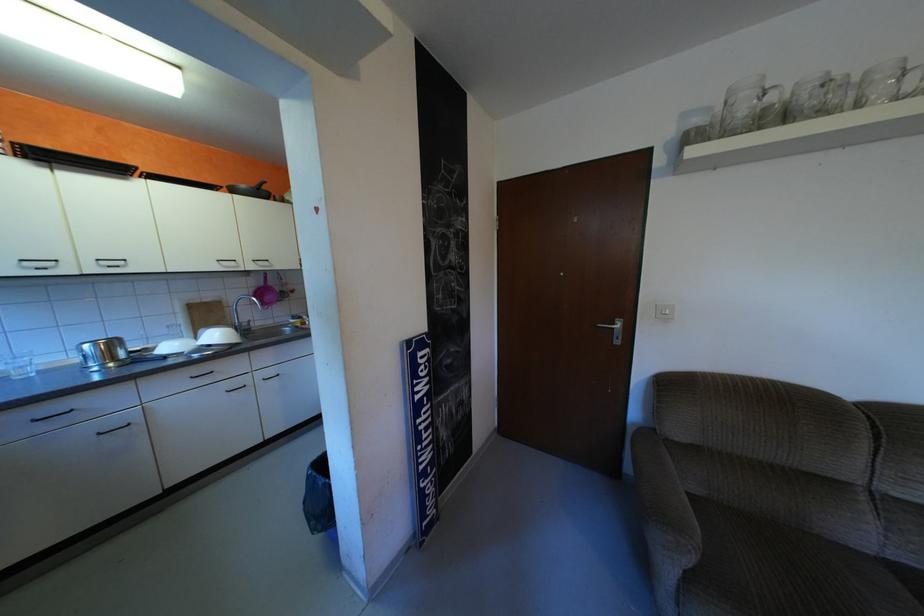
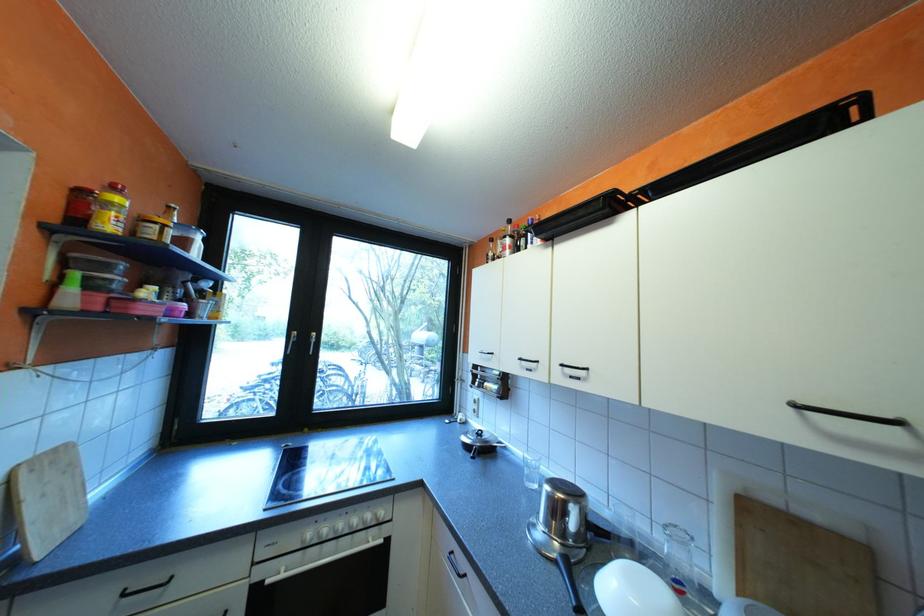
Locate, in the second image, the point that corresponds to point (113, 265) in the first image.

(576, 373)